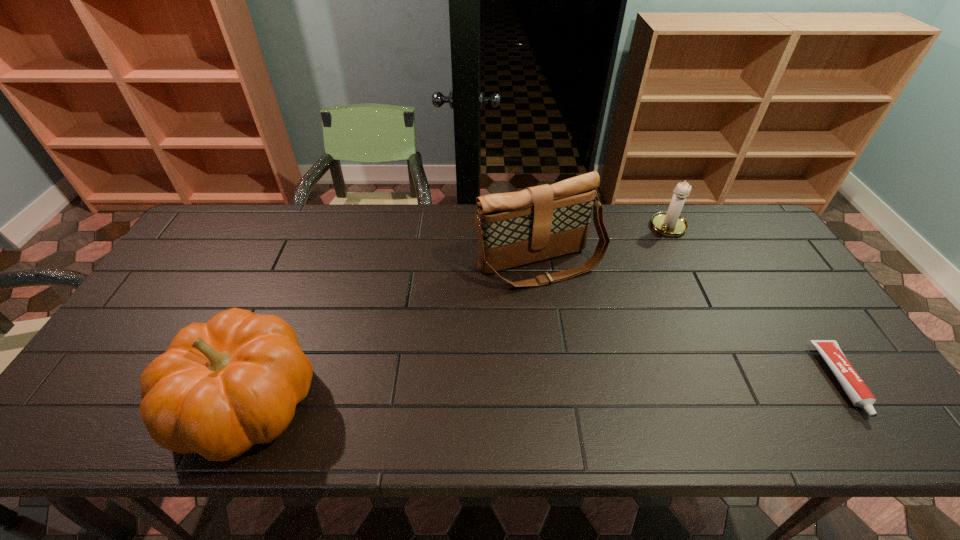
What are the coordinates of `the leftmost object` in the screenshot? It's located at (221, 387).

At what (x,y) coordinates should I click in order to perform the action: click on the shortest object. Please return your answer as a coordinate pair (x, y). This screenshot has width=960, height=540. Looking at the image, I should click on (857, 391).

I want to click on the rightmost object, so click(x=857, y=391).

This screenshot has width=960, height=540. I want to click on the second farthest object, so click(516, 228).

Find the location of a particular element. The image size is (960, 540). the second object from left to right is located at coordinates (516, 228).

At what (x,y) coordinates should I click in order to perform the action: click on the third object from left to right. Please return your answer as a coordinate pair (x, y). Looking at the image, I should click on (670, 223).

In order to click on the second shortest object in this screenshot , I will do [x=670, y=223].

The height and width of the screenshot is (540, 960). Identify the location of free space located 0.260m on the back of the leftmost object. (300, 275).

You are a GUI agent. You are given a task and a screenshot of the screen. Output one action in this format:
    pyautogui.click(x=<x>, y=<y>)
    Task: Click on the vacant space located 0.160m on the front-facing side of the second farthest object
    This screenshot has width=960, height=540.
    Given the screenshot: What is the action you would take?
    pyautogui.click(x=595, y=331)

Where is `vacant point located 0.120m on the front-facing side of the second farthest object`? vacant point located 0.120m on the front-facing side of the second farthest object is located at coordinates (588, 320).